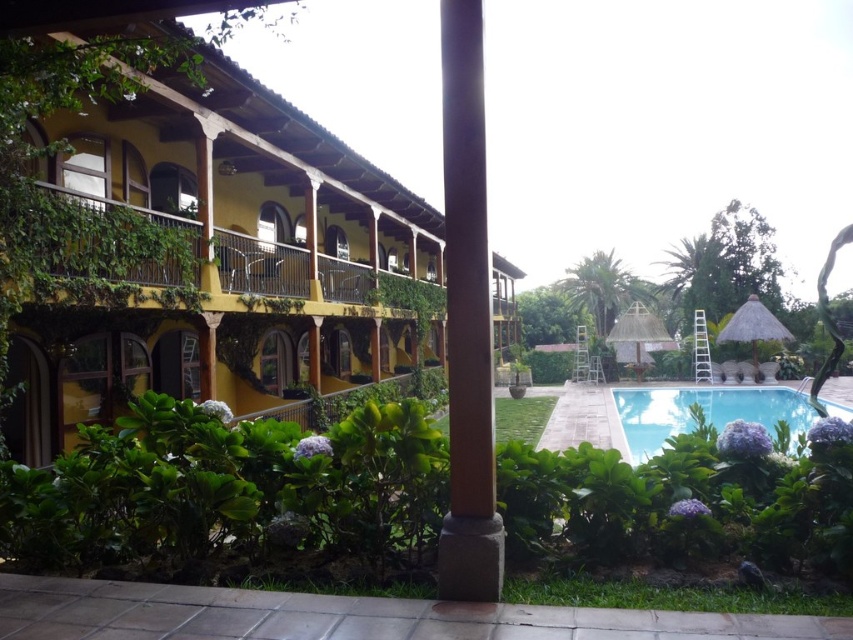
Which is behind, point (479, 147) or point (712, 404)?

The point (712, 404) is more distant.

Between brown stone pillar at center and clear blue water at center, which one has more height?

clear blue water at center is taller.

Who is more distant from viewer, [456,36] or [659,428]?

The point [659,428] is more distant.

The width and height of the screenshot is (853, 640). I want to click on brown stone pillar at center, so click(x=467, y=320).

Is green leafy bush at center taller than brown stone pillar at center?

No, green leafy bush at center is not taller than brown stone pillar at center.

Is green leafy bush at center further to the viewer compared to brown stone pillar at center?

Yes, green leafy bush at center is further from the viewer.

Describe the element at coordinates (227, 486) in the screenshot. This screenshot has width=853, height=640. I see `green leafy bush at center` at that location.

Where is `green leafy bush at center`? Image resolution: width=853 pixels, height=640 pixels. green leafy bush at center is located at coordinates (227, 486).

Is yellow matte building at upper left below clear blue water at center?

Actually, yellow matte building at upper left is above clear blue water at center.

Between point (123, 198) and point (770, 392), which one is positioned in front?

Point (123, 198)

Find the location of a particular element. This screenshot has width=853, height=640. yellow matte building at upper left is located at coordinates (225, 257).